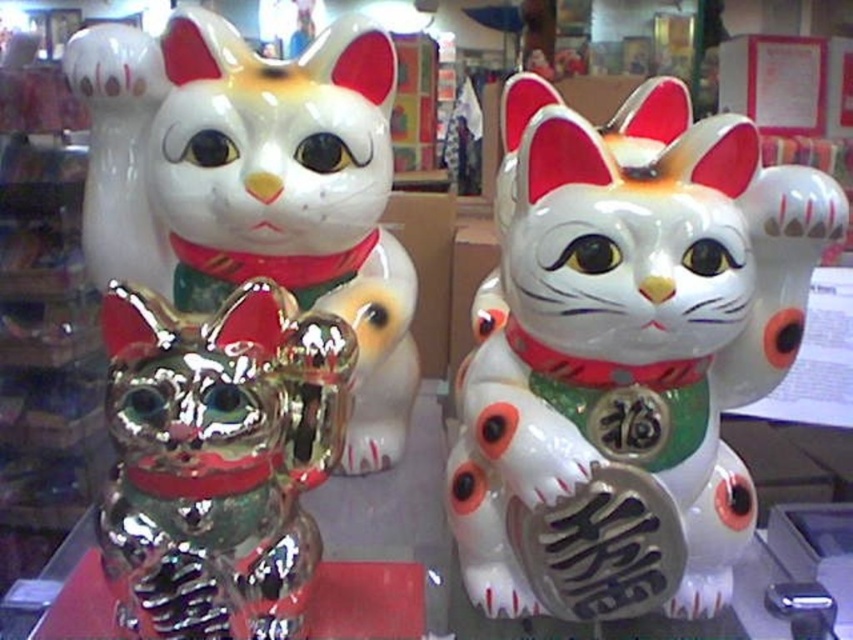
Question: Can you confirm if shiny metallic cat at center is smaller than shiny metallic cat at left?

Choices:
 (A) no
 (B) yes

Answer: (B)

Question: Which object appears closest to the camera in this image?

Choices:
 (A) shiny metallic cat at center
 (B) white glossy ceramic cat at center

Answer: (A)

Question: Which object is closer to the camera taking this photo?

Choices:
 (A) shiny metallic cat at center
 (B) white glossy ceramic cat at center
 (C) shiny metallic cat at left

Answer: (A)

Question: Can you confirm if shiny metallic cat at center is smaller than shiny metallic cat at left?

Choices:
 (A) yes
 (B) no

Answer: (A)

Question: Is shiny metallic cat at center smaller than shiny metallic cat at left?

Choices:
 (A) yes
 (B) no

Answer: (A)

Question: Which of the following is the farthest from the observer?

Choices:
 (A) white glossy ceramic cat at center
 (B) shiny metallic cat at center
 (C) shiny metallic cat at left

Answer: (C)